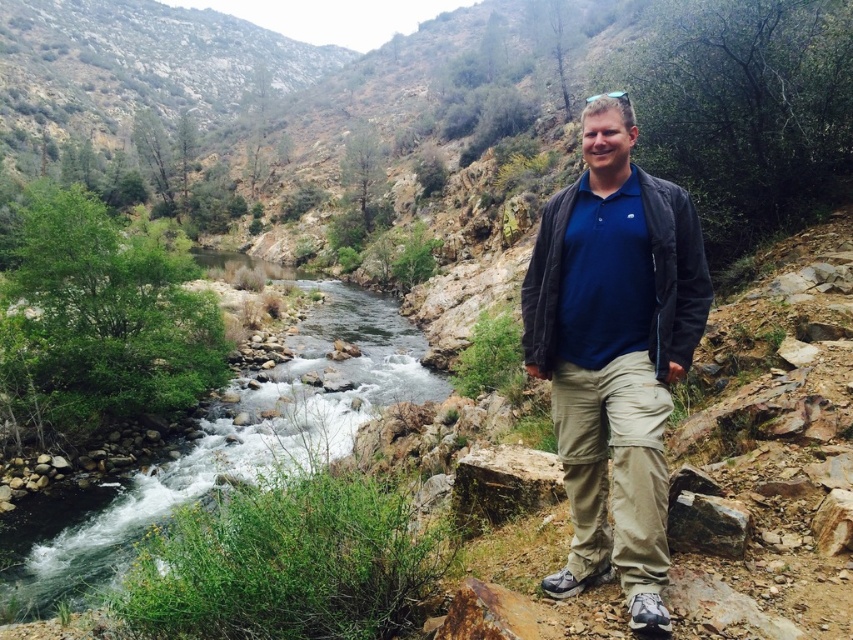
You are an outdoor photographer trying to capture the entire scene in one shot. Given that the matte blue shirt at center and the green rocky stream at left are both in your frame, which object would require you to zoom out more to ensure it is fully visible?

The green rocky stream at left requires zooming out more because it is larger than the matte blue shirt at center.

You are a photographer positioned at the origin point of the image. You want to capture a shot of the matte blue shirt at center. Which direction should you move your camera to align it with the shirt?

The matte blue shirt at center is located at point (614, 352), so you should move your camera slightly to the right and upwards to align with the shirt.